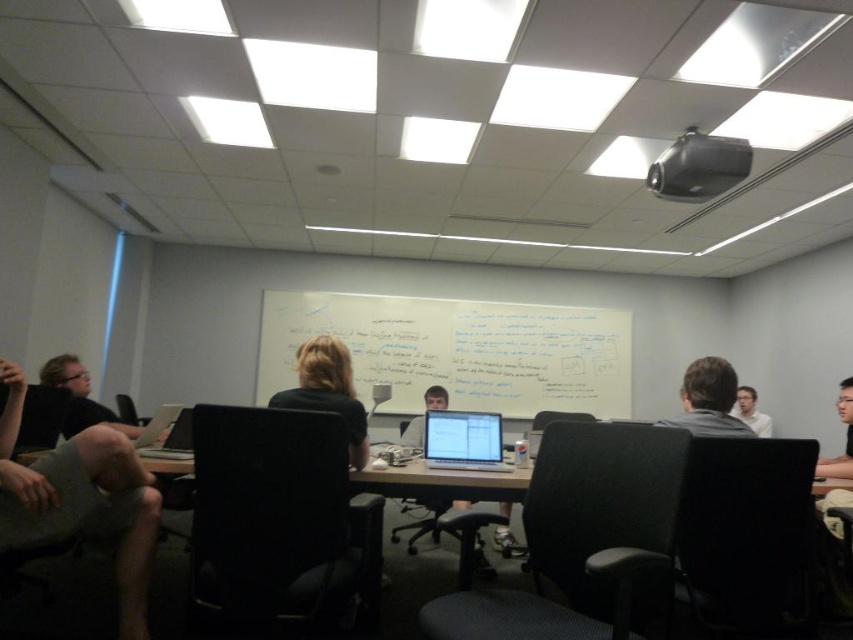
Is point (711, 595) positioned behind point (434, 508)?

That is False.

Who is higher up, black plastic chair at lower right or black mesh chair at center?

black plastic chair at lower right

Locate an element on the screen. black plastic chair at lower right is located at coordinates (746, 536).

Identify the location of black plastic chair at lower right. (746, 536).

Does dark gray fabric chair at center have a greater height compared to smooth skin face at right?

Correct, dark gray fabric chair at center is much taller as smooth skin face at right.

Between dark gray fabric chair at center and smooth skin face at right, which one has more height?

dark gray fabric chair at center is taller.

Does point (639, 493) lie behind point (846, 456)?

No, (639, 493) is closer to viewer.

Identify the location of dark gray fabric chair at center. (584, 540).

Is black plastic projector at upper center behind blonde hair at center?

Yes, it is behind blonde hair at center.

Who is positioned more to the right, black plastic projector at upper center or blonde hair at center?

black plastic projector at upper center is more to the right.

Is point (724, 161) less distant than point (323, 372)?

That is False.

In order to click on black plastic projector at upper center in this screenshot , I will do `click(698, 166)`.